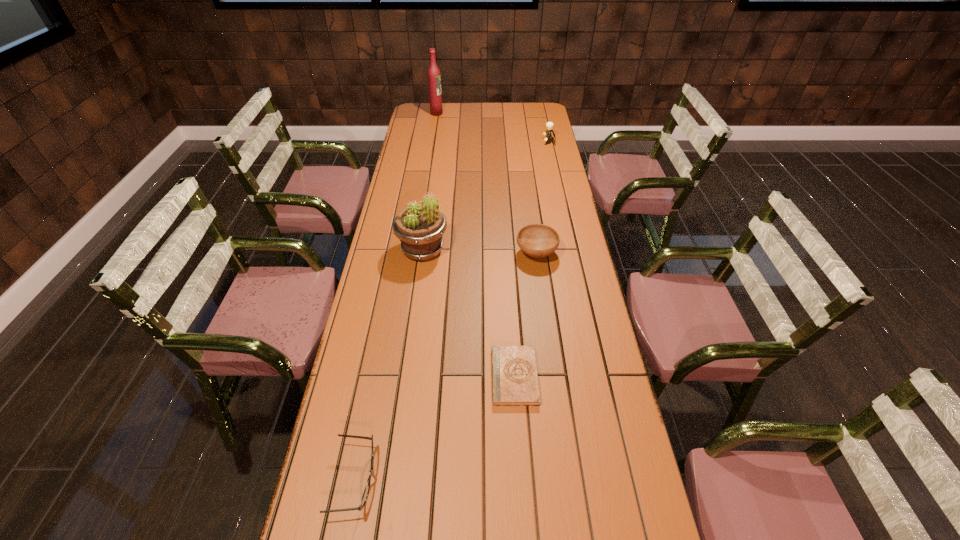
Locate an element on the screen. The image size is (960, 540). object that is at the far edge is located at coordinates (434, 79).

You are a GUI agent. You are given a task and a screenshot of the screen. Output one action in this format:
    pyautogui.click(x=<x>, y=<y>)
    Task: Click on the liquor that is at the left edge
    The image size is (960, 540).
    Given the screenshot: What is the action you would take?
    pyautogui.click(x=434, y=79)

Locate an element on the screen. The image size is (960, 540). flowerpot that is positioned at the left edge is located at coordinates (420, 228).

At what (x,y) coordinates should I click in order to perform the action: click on spectacles that is at the left edge. Please return your answer as a coordinate pair (x, y). The image size is (960, 540). Looking at the image, I should click on (366, 491).

This screenshot has height=540, width=960. I want to click on Lego at the right edge, so click(x=549, y=125).

This screenshot has height=540, width=960. I want to click on bowl present at the right edge, so click(x=536, y=240).

This screenshot has width=960, height=540. Find the location of `object present at the far left corner`. object present at the far left corner is located at coordinates (434, 79).

I want to click on free location at the far edge of the desktop, so click(476, 111).

In the image, there is a desktop. What are the coordinates of `vacant space at the left edge` in the screenshot? It's located at (363, 335).

At what (x,y) coordinates should I click in order to perform the action: click on vacant area at the right edge of the desktop. Please return your answer as a coordinate pair (x, y). This screenshot has height=540, width=960. Looking at the image, I should click on (553, 138).